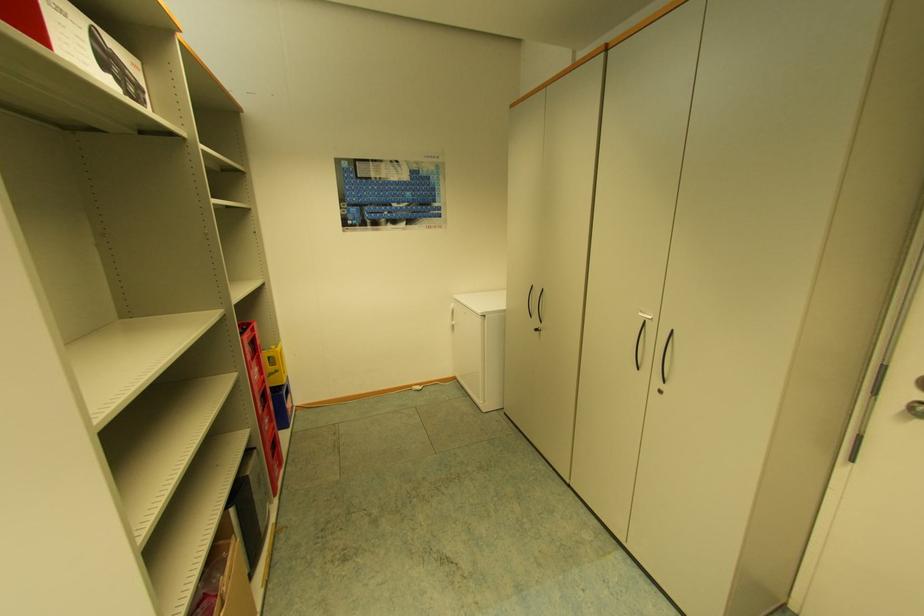
What do you see at coordinates (261, 402) in the screenshot? I see `the red plastic crate` at bounding box center [261, 402].